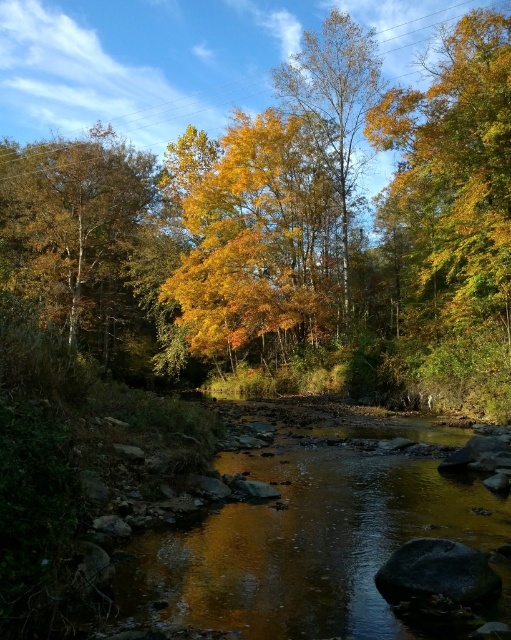
Question: Can you confirm if golden textured leaves at left is positioned to the left of yellow/golden leaves at center?

Choices:
 (A) yes
 (B) no

Answer: (A)

Question: Estimate the real-world distances between objects in this image. Which object is farther from the golden leafy tree at center?

Choices:
 (A) shiny brown water at center
 (B) yellow/golden leaves at center

Answer: (A)

Question: Does golden textured leaves at left appear on the left side of yellow/golden leaves at center?

Choices:
 (A) yes
 (B) no

Answer: (A)

Question: Which of the following is the farthest from the observer?

Choices:
 (A) (43, 230)
 (B) (461, 371)
 (C) (357, 54)

Answer: (A)

Question: Which point appears farthest from the camera in this image?

Choices:
 (A) (91, 339)
 (B) (172, 616)
 (C) (338, 202)
 (D) (128, 193)

Answer: (D)

Question: Considering the relative positions of shiny brown water at center and golden leafy tree at center in the image provided, where is shiny brown water at center located with respect to golden leafy tree at center?

Choices:
 (A) right
 (B) left

Answer: (A)